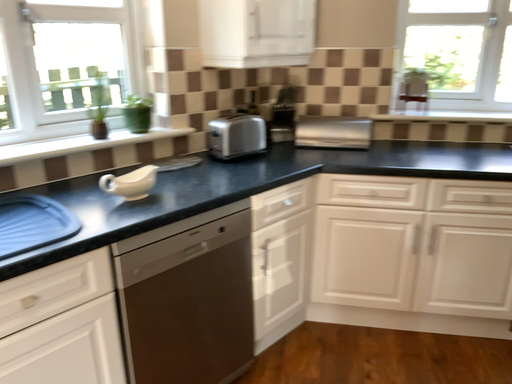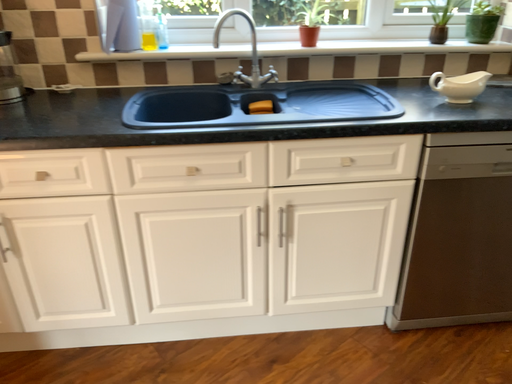
Question: How did the camera likely rotate when shooting the video?

Choices:
 (A) rotated right
 (B) rotated left

Answer: (B)